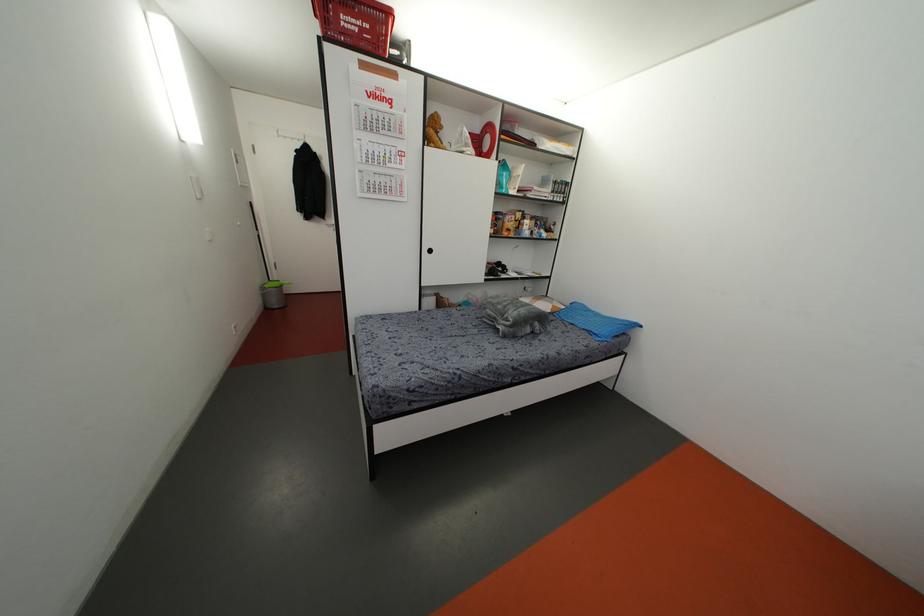
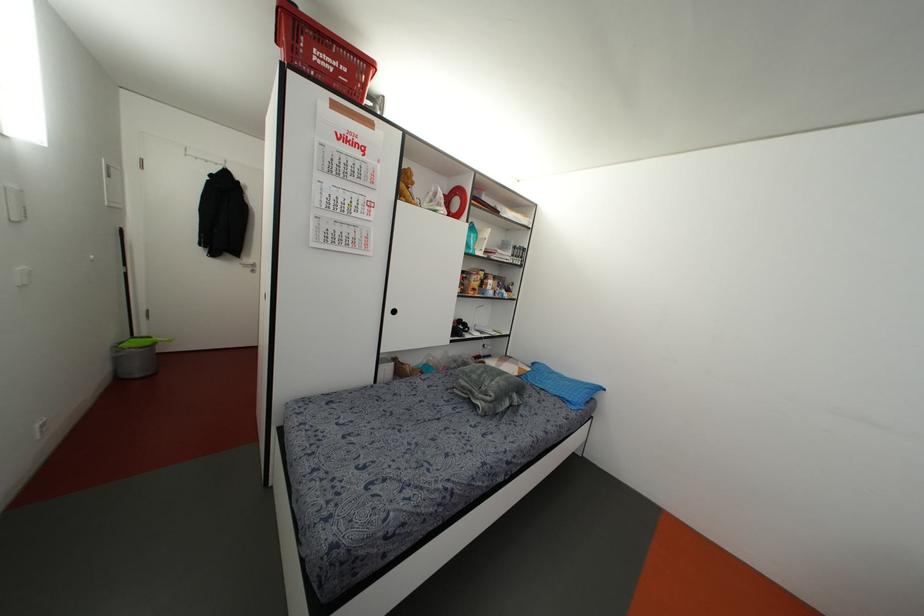
Question: How did the camera likely rotate?

Choices:
 (A) Left
 (B) Right
 (C) Up
 (D) Down

Answer: (B)